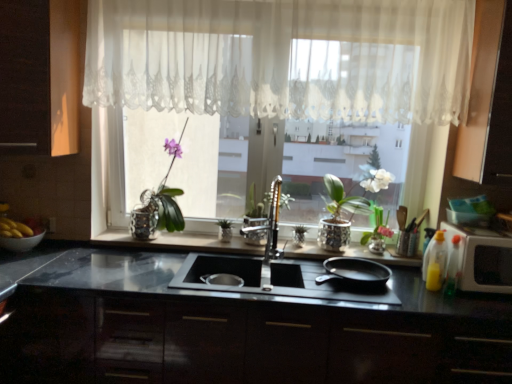
Where is `vacant area in front of yellow translucent bottle at right, which is the 2th bottle in left-to-right order`? vacant area in front of yellow translucent bottle at right, which is the 2th bottle in left-to-right order is located at coordinates (470, 308).